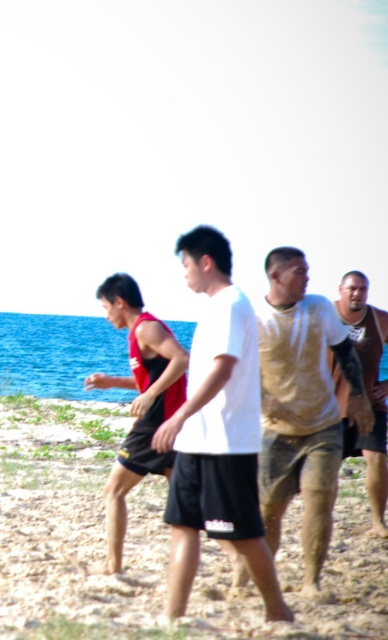
Between point (185, 259) and point (138, 314), which one is positioned behind?

Point (138, 314)

Between white matte t-shirt at center and red fabric tank top at left, which one appears on the right side from the viewer's perspective?

white matte t-shirt at center

Is point (247, 342) positioned after point (131, 445)?

No.

Locate an element on the screen. This screenshot has height=640, width=388. white matte t-shirt at center is located at coordinates (216, 432).

The image size is (388, 640). Find the location of `red fabric tank top at left`. red fabric tank top at left is located at coordinates (138, 397).

In the scene shown: Is red fabric tank top at left to the left of gold textured shirt at right from the viewer's perspective?

Yes, red fabric tank top at left is to the left of gold textured shirt at right.

Locate an element on the screen. This screenshot has width=388, height=640. red fabric tank top at left is located at coordinates (138, 397).

This screenshot has height=640, width=388. I want to click on red fabric tank top at left, so click(138, 397).

Does gravelly sand at center come behind gold textured shirt at right?

That is False.

Is gravelly sand at center smaller than gold textured shirt at right?

No, gravelly sand at center is not smaller than gold textured shirt at right.

Locate an element on the screen. gravelly sand at center is located at coordinates (148, 545).